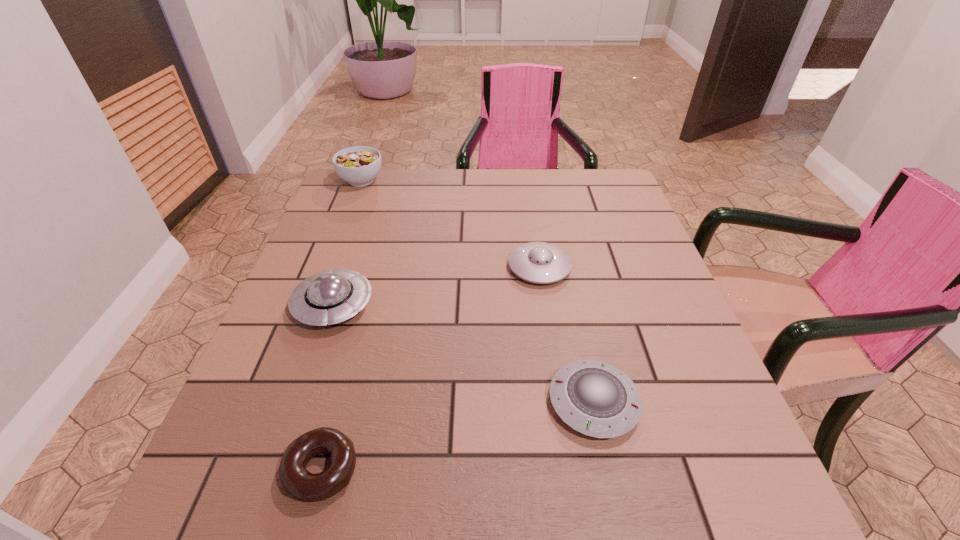
Where is `the farthest object`? The image size is (960, 540). the farthest object is located at coordinates (359, 166).

Where is `the leftmost saucer`? This screenshot has width=960, height=540. the leftmost saucer is located at coordinates (329, 297).

Where is `the nearest saucer`? The width and height of the screenshot is (960, 540). the nearest saucer is located at coordinates (594, 398).

You are a GUI agent. You are given a task and a screenshot of the screen. Output one action in this format:
    pyautogui.click(x=<x>, y=<y>)
    Task: Click on the doughnut
    Image resolution: width=960 pixels, height=540 pixels.
    Given the screenshot: What is the action you would take?
    pyautogui.click(x=295, y=480)

At what (x,y) coordinates should I click in order to perform the action: click on vacant space located 0.300m on the front of the soup bowl. Please return your answer as a coordinate pair (x, y). Image resolution: width=960 pixels, height=540 pixels. Looking at the image, I should click on (330, 259).

The image size is (960, 540). In order to click on free space located 0.220m on the front of the tallest saucer in this screenshot , I will do `click(287, 441)`.

The width and height of the screenshot is (960, 540). What are the coordinates of `vacant space positioned 0.070m on the right of the nearest saucer` in the screenshot? It's located at (679, 402).

The width and height of the screenshot is (960, 540). In order to click on free location located 0.080m on the left of the doughnut in this screenshot , I will do `click(232, 470)`.

In order to click on object that is at the far edge in this screenshot , I will do `click(359, 166)`.

Identify the location of object located at the near edge. The width and height of the screenshot is (960, 540). (295, 480).